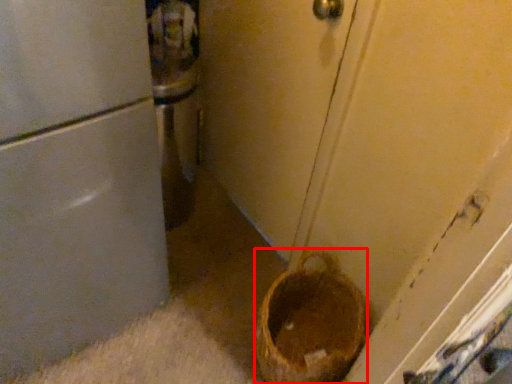
Question: In this image, where is basket container (annotated by the red box) located relative to door?

Choices:
 (A) left
 (B) right

Answer: (B)